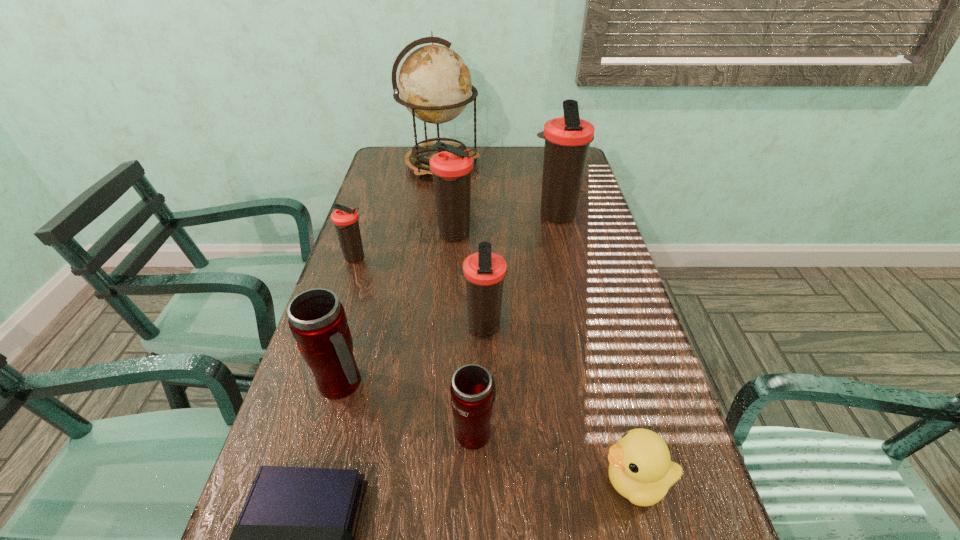
Where is `globe`? The height and width of the screenshot is (540, 960). globe is located at coordinates (434, 83).

At what (x,y) coordinates should I click in order to perform the action: click on the farthest object. Please return your answer as a coordinate pair (x, y). Image resolution: width=960 pixels, height=540 pixels. Looking at the image, I should click on (434, 83).

You are a GUI agent. You are given a task and a screenshot of the screen. Output one action in this format:
    pyautogui.click(x=<x>, y=<y>)
    Task: Click on the biggest brown thermos bottle
    Image resolution: width=960 pixels, height=540 pixels.
    Given the screenshot: What is the action you would take?
    pyautogui.click(x=567, y=139)

The width and height of the screenshot is (960, 540). Find the location of `the rightmost thermos bottle`. the rightmost thermos bottle is located at coordinates (567, 139).

Locate an element on the screen. the second tallest thermos bottle is located at coordinates (451, 169).

Identify the location of the second biggest brown thermos bottle. (451, 169).

Identify the location of the nearest brown thermos bottle. (484, 271).

Where is `the second smallest brown thermos bottle`? This screenshot has height=540, width=960. the second smallest brown thermos bottle is located at coordinates (484, 271).

Where is `the farther red thermos bottle`? The image size is (960, 540). the farther red thermos bottle is located at coordinates (317, 320).

In order to click on the bigger red thermos bottle in this screenshot , I will do `click(317, 320)`.